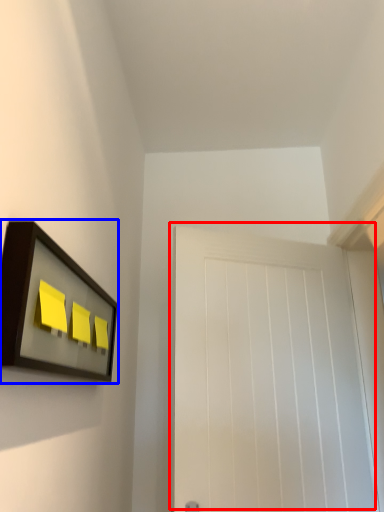
Question: Which object is closer to the camera taking this photo, door (highlighted by a red box) or picture frame (highlighted by a blue box)?

Choices:
 (A) door
 (B) picture frame

Answer: (B)